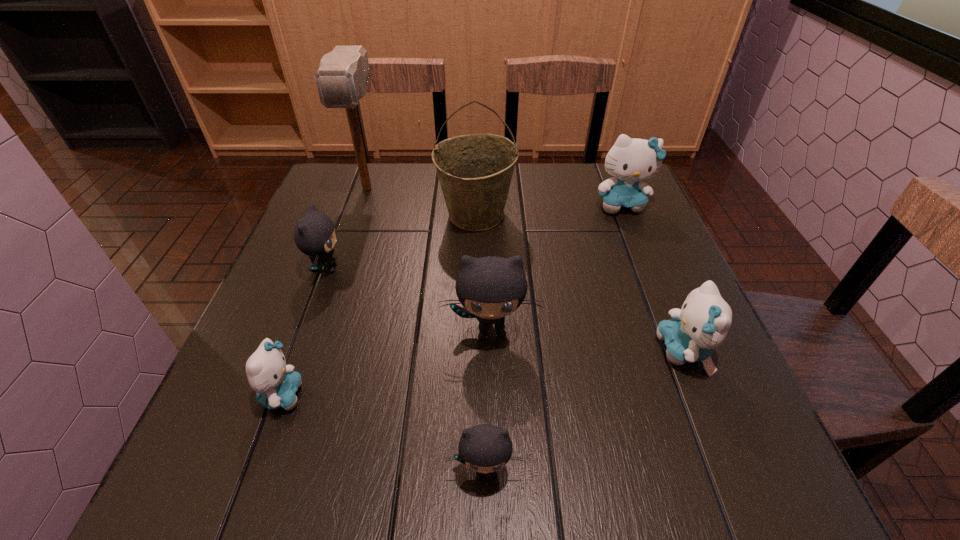
Locate an element on the screen. Image resolution: width=960 pixels, height=540 pixels. mallet is located at coordinates (342, 79).

In order to click on wine bucket in this screenshot , I will do `click(475, 171)`.

The height and width of the screenshot is (540, 960). What are the coordinates of `the biggest blue kitten` in the screenshot? It's located at (630, 161).

I want to click on the farthest kitten, so pyautogui.click(x=630, y=161).

Find the location of a particular element. This screenshot has height=540, width=960. the biggest gray kitten is located at coordinates (489, 288).

Locate an element on the screen. the second biggest blue kitten is located at coordinates coord(703,322).

Image resolution: width=960 pixels, height=540 pixels. What are the coordinates of `the farthest gray kitten` in the screenshot? It's located at (314, 234).

The width and height of the screenshot is (960, 540). Find the location of `the fifth nearest object`. the fifth nearest object is located at coordinates (314, 234).

This screenshot has height=540, width=960. Identify the location of the smallest blue kitten. (275, 383).

Image resolution: width=960 pixels, height=540 pixels. What are the coordinates of `the nearest object` in the screenshot? It's located at (484, 448).